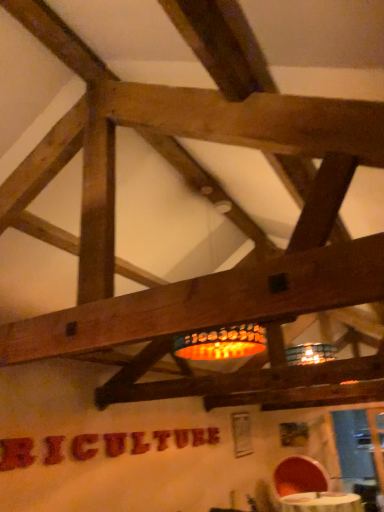
Find the location of a particular element. The height and width of the screenshot is (512, 384). wooden table at lower right is located at coordinates (322, 502).

What do you see at coordinates (322, 502) in the screenshot?
I see `wooden table at lower right` at bounding box center [322, 502].

Find the location of a particular element. The image size is (384, 512). wooden table at lower right is located at coordinates (322, 502).